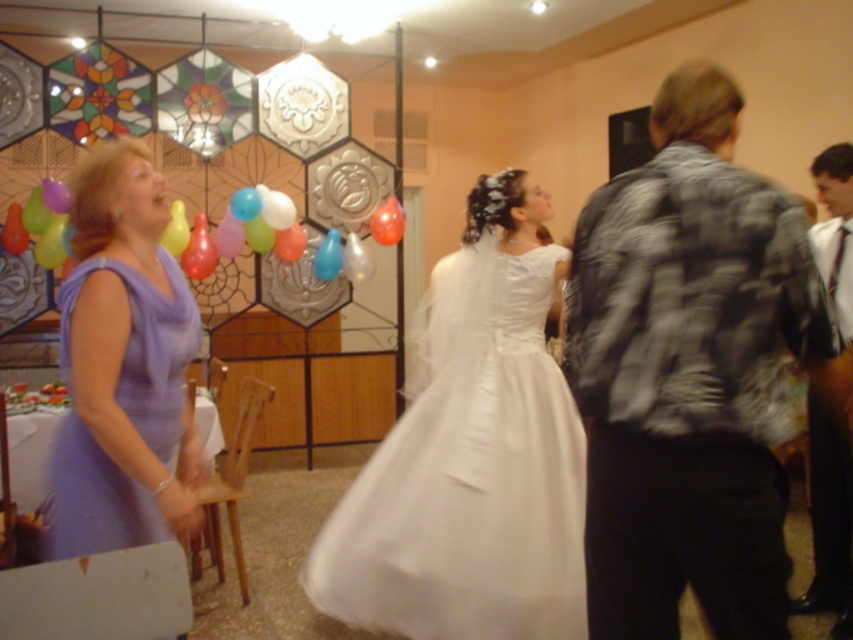
Question: Can you confirm if plaid fabric jacket at right is positioned below translucent plastic balloon at upper center?

Choices:
 (A) no
 (B) yes

Answer: (B)

Question: Is lavender satin dress at left positioned in front of translucent plastic balloon at center?

Choices:
 (A) no
 (B) yes

Answer: (B)

Question: Among these objects, which one is farthest from the camera?

Choices:
 (A) lavender satin dress at left
 (B) satin white dress at center
 (C) plaid fabric jacket at right

Answer: (B)

Question: Which point is farther to the camera?

Choices:
 (A) translucent plastic balloon at upper center
 (B) blue glossy balloon at center

Answer: (A)

Question: Is lavender satin dress at left smaller than shiny black jacket at right?

Choices:
 (A) yes
 (B) no

Answer: (B)

Question: Among these objects, which one is farthest from the camera?

Choices:
 (A) blue glossy balloon at center
 (B) satin white dress at center

Answer: (A)